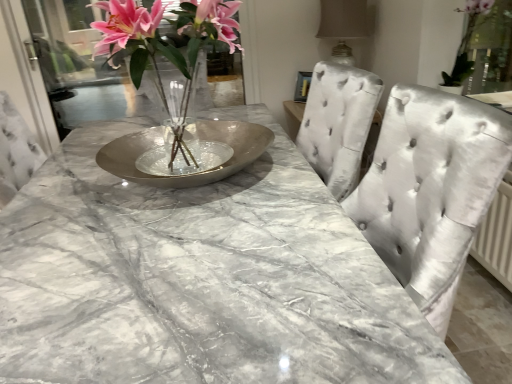
Question: Can you confirm if metallic vase at center is wider than silver metallic bowl at center?

Choices:
 (A) yes
 (B) no

Answer: (B)

Question: Is metallic vase at center facing away from silver metallic bowl at center?

Choices:
 (A) yes
 (B) no

Answer: (B)

Question: Considering the relative sizes of metallic vase at center and silver metallic bowl at center in the image provided, is metallic vase at center thinner than silver metallic bowl at center?

Choices:
 (A) no
 (B) yes

Answer: (B)

Question: From a real-world perspective, does metallic vase at center sit lower than silver metallic bowl at center?

Choices:
 (A) no
 (B) yes

Answer: (A)

Question: Is metallic vase at center next to silver metallic bowl at center and touching it?

Choices:
 (A) yes
 (B) no

Answer: (B)

Question: Considering their positions, is satin beige lampshade at upper right located in front of or behind green leafy plant at upper right?

Choices:
 (A) behind
 (B) front

Answer: (A)

Question: Is satin beige lampshade at upper right taller or shorter than green leafy plant at upper right?

Choices:
 (A) tall
 (B) short

Answer: (A)

Question: From the image's perspective, is satin beige lampshade at upper right positioned above or below green leafy plant at upper right?

Choices:
 (A) above
 (B) below

Answer: (A)

Question: Is satin beige lampshade at upper right bigger or smaller than green leafy plant at upper right?

Choices:
 (A) big
 (B) small

Answer: (A)

Question: Is transparent glass door at upper left inside or outside of satin silver chair at center?

Choices:
 (A) outside
 (B) inside

Answer: (A)

Question: Considering the positions of transparent glass door at upper left and satin silver chair at center in the image, is transparent glass door at upper left wider or thinner than satin silver chair at center?

Choices:
 (A) wide
 (B) thin

Answer: (B)

Question: Is transparent glass door at upper left in front of or behind satin silver chair at center in the image?

Choices:
 (A) front
 (B) behind

Answer: (B)

Question: From a real-world perspective, is transparent glass door at upper left positioned above or below satin silver chair at center?

Choices:
 (A) below
 (B) above

Answer: (B)

Question: From a real-world perspective, is metallic vase at center above or below satin silver chair at center?

Choices:
 (A) above
 (B) below

Answer: (A)

Question: Is point (129, 29) closer or farther from the camera than point (310, 142)?

Choices:
 (A) farther
 (B) closer

Answer: (B)